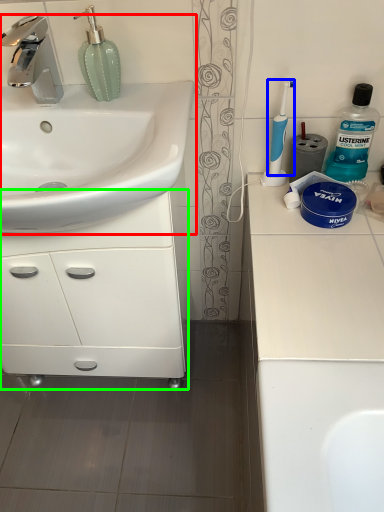
Question: Which object is positioned farthest from sink (highlighted by a red box)? Select from toothbrush (highlighted by a blue box) and bathroom cabinet (highlighted by a green box).

Choices:
 (A) toothbrush
 (B) bathroom cabinet

Answer: (A)